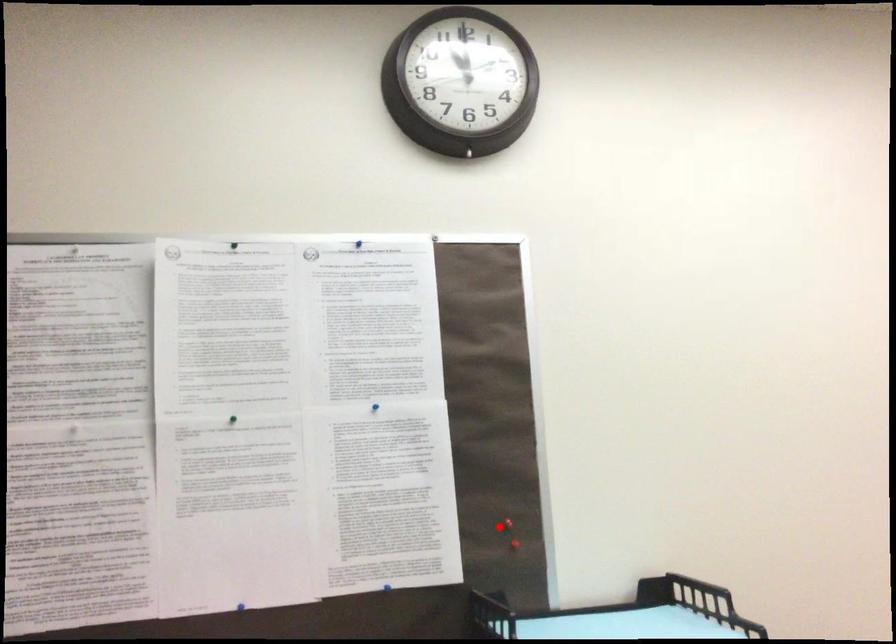
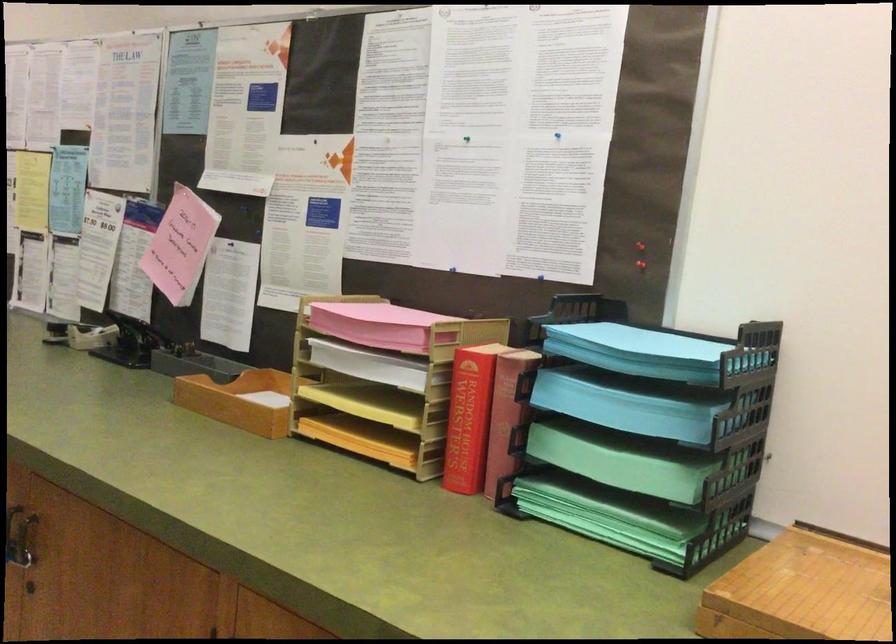
Question: I am providing you with two images of the same scene from different viewpoints. In image1, a red point is highlighted. Considering the same 3D point in image2, which of the following is correct?

Choices:
 (A) It is closer
 (B) It is farther

Answer: (B)